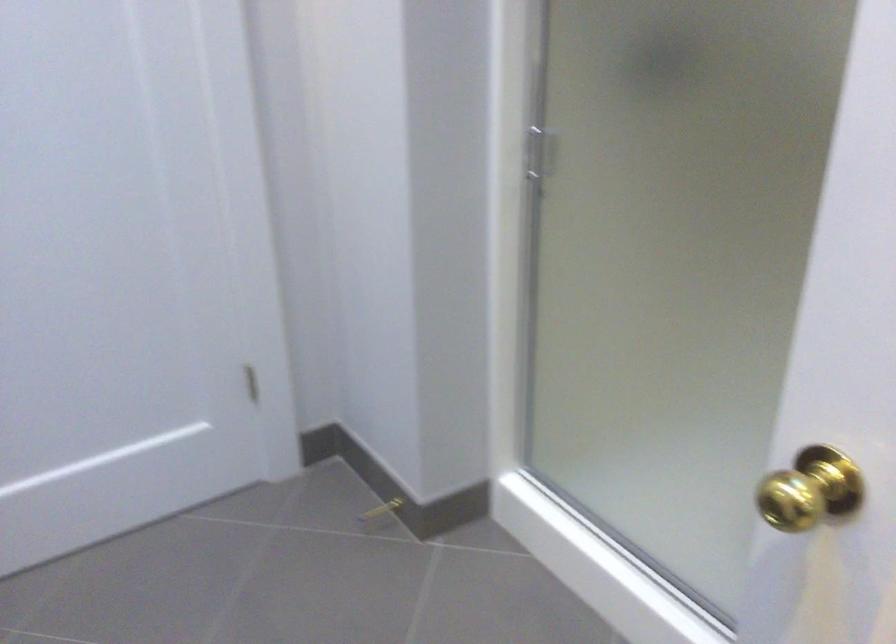
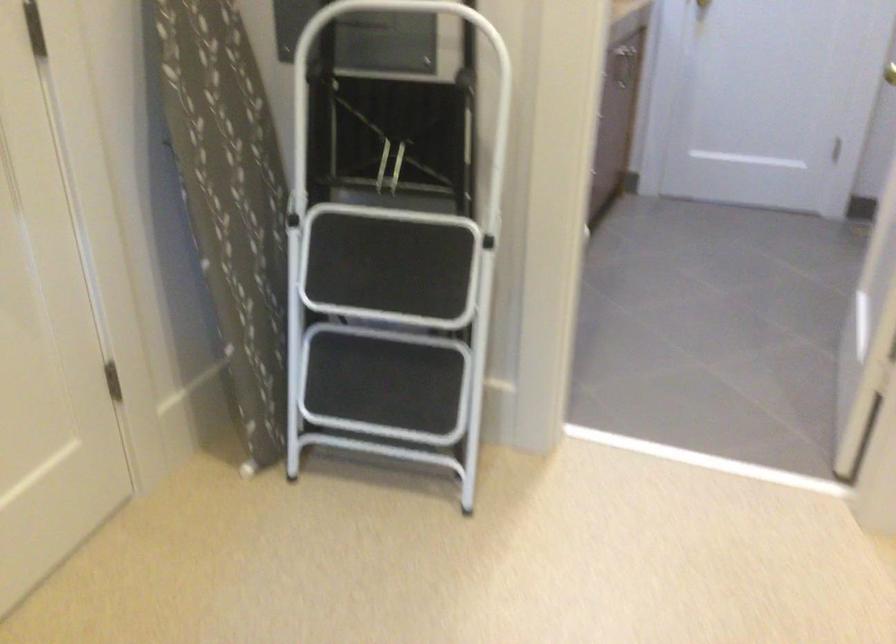
Locate, in the second image, the point that corresponds to [268,257] in the first image.

(890, 73)